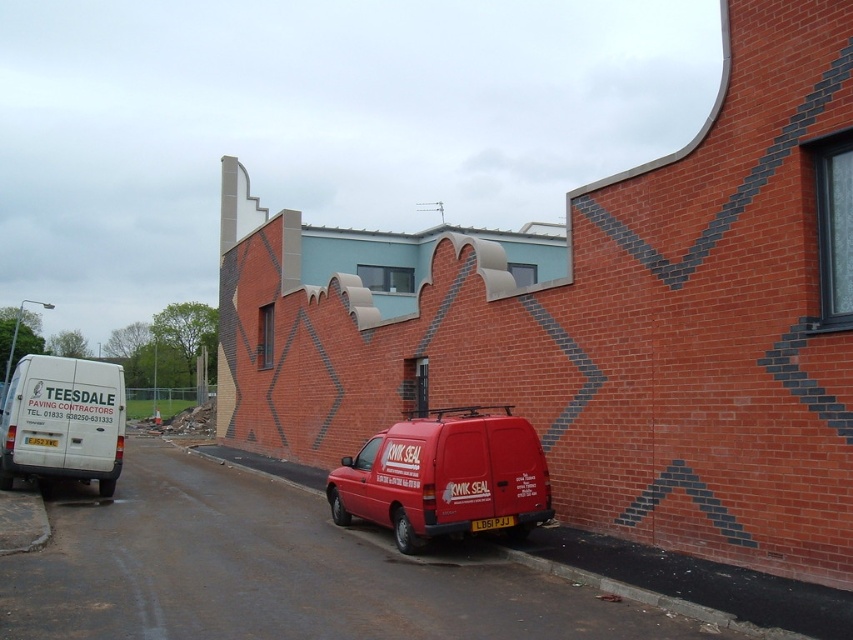
Question: Where is matte red van at center located in relation to white matte van at left in the image?

Choices:
 (A) below
 (B) above

Answer: (A)

Question: Does matte red van at center appear on the right side of white matte van at left?

Choices:
 (A) yes
 (B) no

Answer: (A)

Question: Which object is farther from the camera taking this photo?

Choices:
 (A) white matte van at left
 (B) matte red van at center

Answer: (A)

Question: Which of the following is the farthest from the observer?

Choices:
 (A) matte red van at center
 (B) white matte van at left

Answer: (B)

Question: Which point is farther from the camera taking this photo?

Choices:
 (A) (19, 436)
 (B) (496, 496)

Answer: (A)

Question: Can you confirm if matte red van at center is positioned above white matte van at left?

Choices:
 (A) yes
 (B) no

Answer: (B)